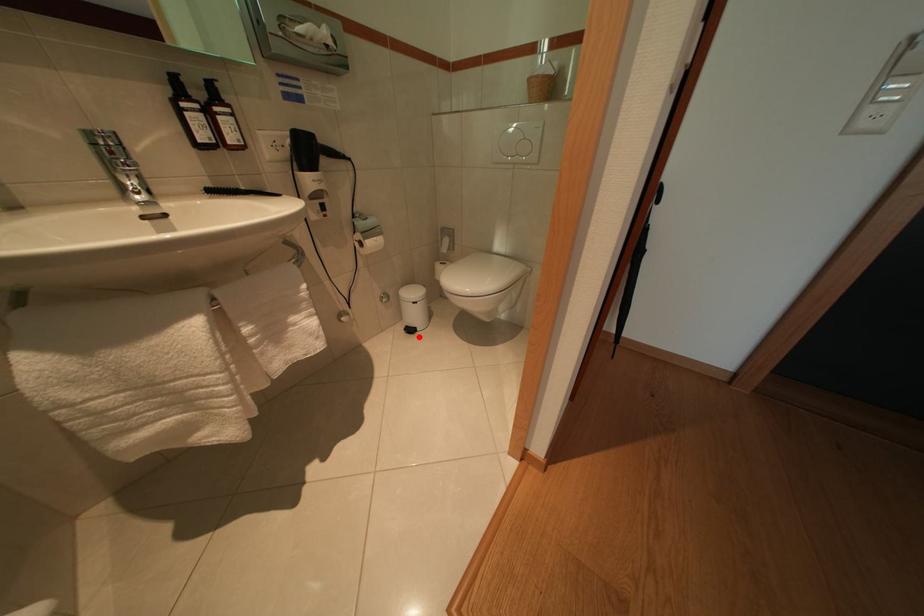
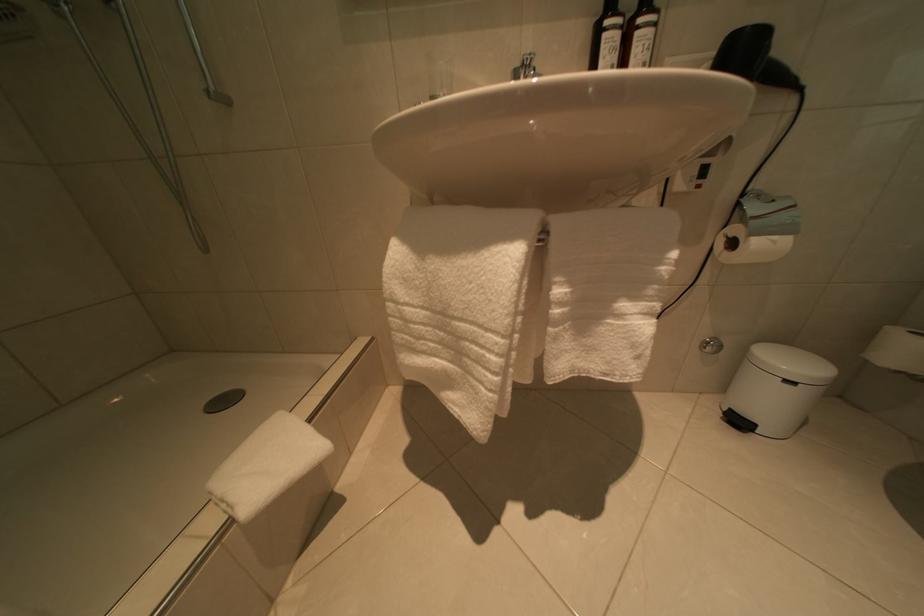
Locate, in the second image, the point that corresponds to the highlighted location in the first image.

(746, 428)